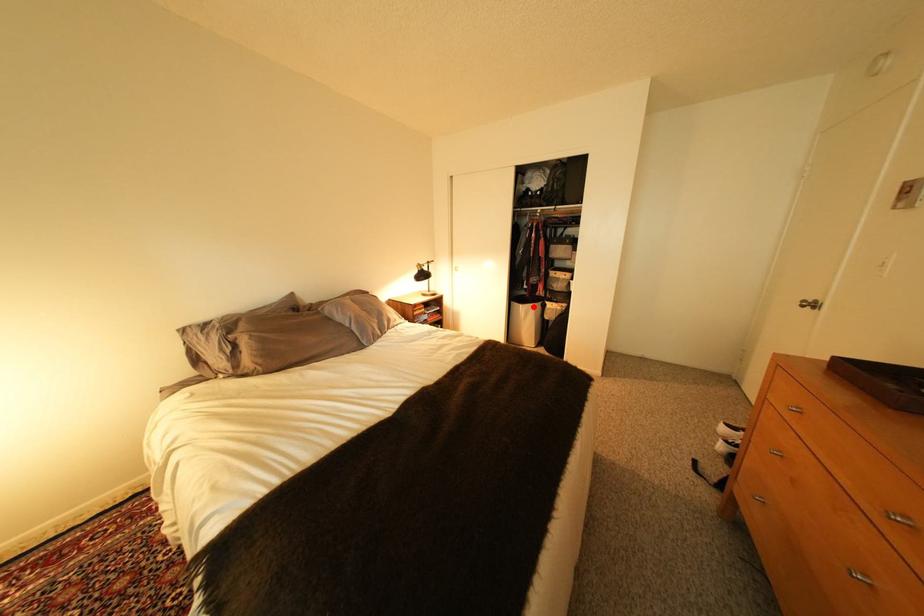
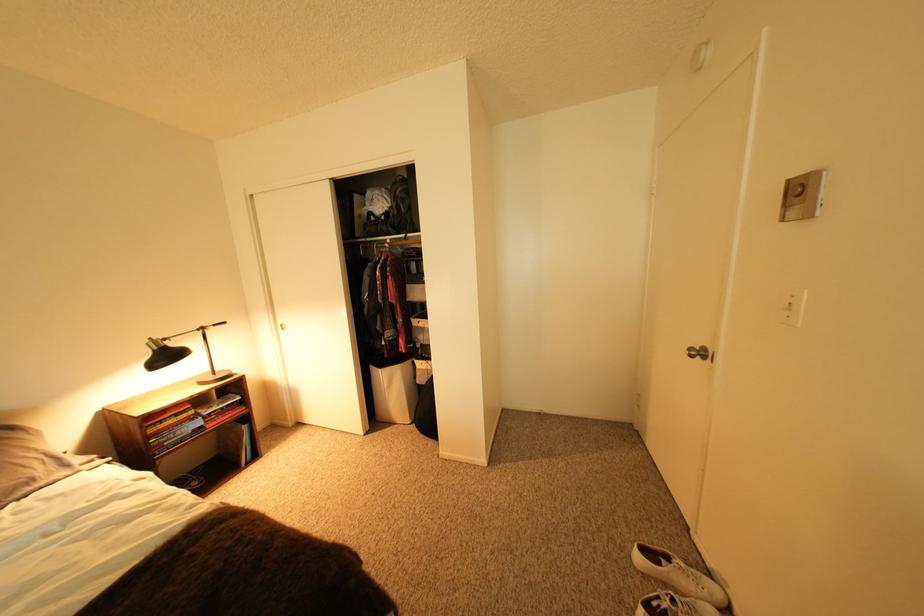
Locate, in the second image, the point that corresponds to the highlighted location in the first image.

(393, 371)